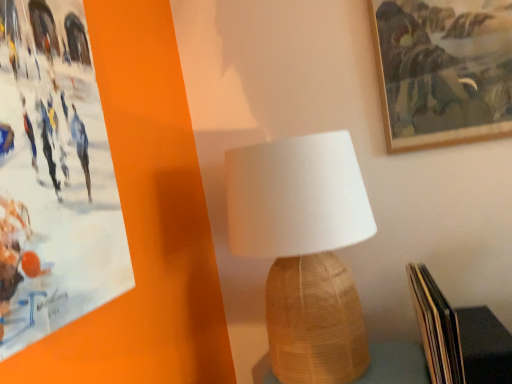
Question: Looking at their shapes, would you say wooden picture frame at upper right is wider or thinner than woven wood table at center?

Choices:
 (A) wide
 (B) thin

Answer: (B)

Question: In terms of height, does wooden picture frame at upper right look taller or shorter compared to woven wood table at center?

Choices:
 (A) short
 (B) tall

Answer: (B)

Question: Which is nearer to the woven wood table at center?

Choices:
 (A) wooden picture frame at upper right
 (B) hardcover book at lower right
 (C) white woven lampshade at center

Answer: (B)

Question: Estimate the real-world distances between objects in this image. Which object is closer to the white woven lampshade at center?

Choices:
 (A) woven wood table at center
 (B) wooden picture frame at upper right
 (C) hardcover book at lower right

Answer: (C)